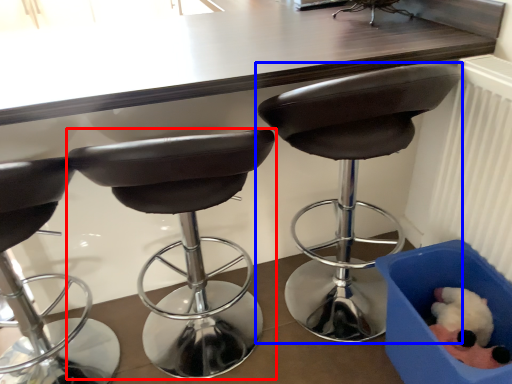
Question: Among these objects, which one is farthest to the camera, chair (highlighted by a red box) or chair (highlighted by a blue box)?

Choices:
 (A) chair
 (B) chair

Answer: (B)